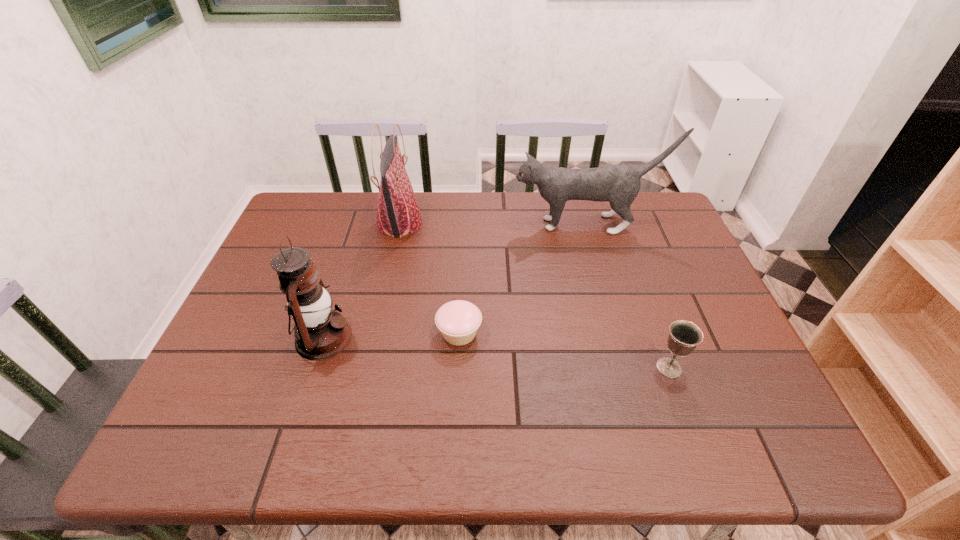
Where is `free space located 0.160m on the side of the lantern, there is a wick adjustment knob`? free space located 0.160m on the side of the lantern, there is a wick adjustment knob is located at coordinates (419, 338).

At what (x,y) coordinates should I click in order to perform the action: click on blank space located on the right of the chalice. Please return your answer as a coordinate pair (x, y). Looking at the image, I should click on (732, 368).

You are a GUI agent. You are given a task and a screenshot of the screen. Output one action in this format:
    pyautogui.click(x=<x>, y=<y>)
    Task: Click on the vacant space situated 0.060m on the left of the cupcake
    
    Given the screenshot: What is the action you would take?
    pyautogui.click(x=412, y=333)

Where is `handbag present at the far edge`? This screenshot has width=960, height=540. handbag present at the far edge is located at coordinates (398, 214).

I want to click on cat that is at the far edge, so click(619, 184).

Identify the location of cat present at the right edge. This screenshot has width=960, height=540. (619, 184).

I want to click on chalice that is at the right edge, so click(684, 336).

Locate an element on the screen. The height and width of the screenshot is (540, 960). object present at the far right corner is located at coordinates (619, 184).

In the image, there is a desktop. In order to click on vacant space at the far edge in this screenshot , I will do `click(453, 195)`.

This screenshot has height=540, width=960. I want to click on vacant space at the near edge, so click(x=455, y=420).